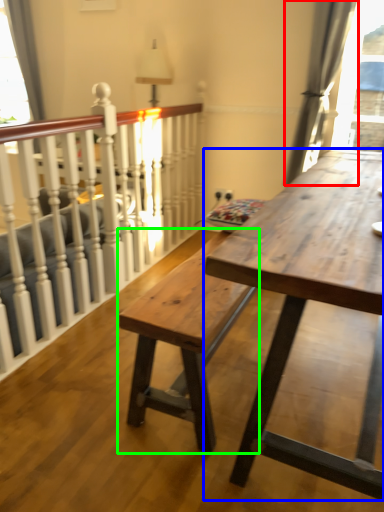
Question: Which object is the farthest from curtain (highlighted by a red box)? Choose among these: table (highlighted by a blue box) or bench (highlighted by a green box).

Choices:
 (A) table
 (B) bench

Answer: (B)